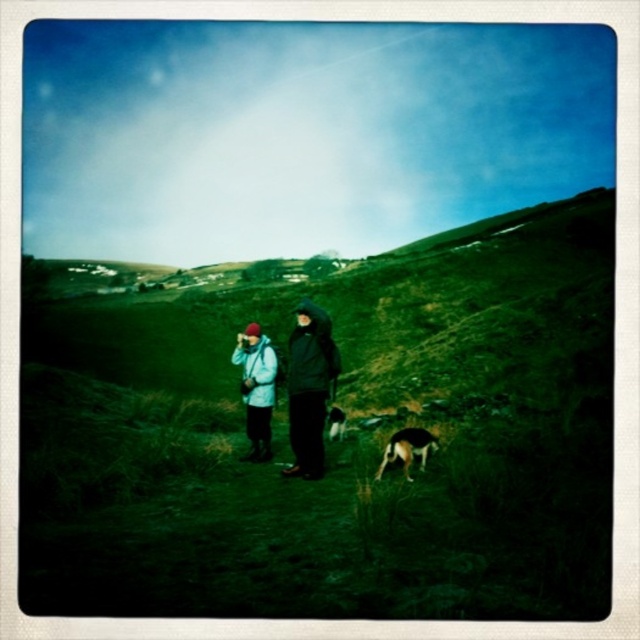
You are standing in the scene and want to take a photo of both the point at coordinates point (x=269, y=422) and point (x=378, y=476). Since you can only focus on one point at a time, which point should you focus on first to ensure the other is still in focus?

You should focus on point (x=269, y=422) first because it is closer to the camera than point (x=378, y=476). This way, the other point will still be within the depth of field if the focus is set on the closer one.

You are a photographer standing at the matte black jacket at center. You want to take a photo of the brown fur dog at center. Can you reach the dog within 15 feet without moving from your current position?

The distance between the matte black jacket at center and the brown fur dog at center is 13.09 feet, so yes, you can reach the dog within 15 feet without moving from your current position.